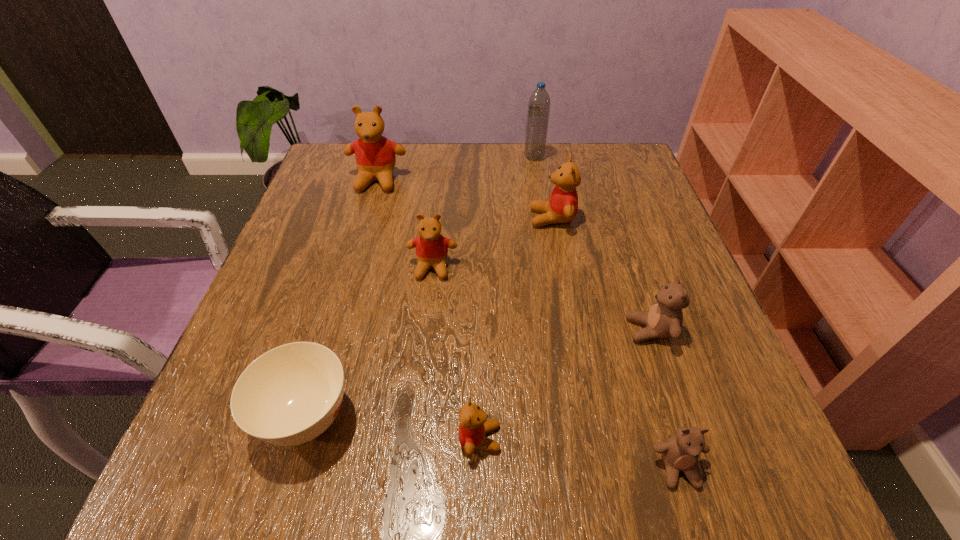
This screenshot has width=960, height=540. I want to click on vacant space at the near right corner of the desktop, so click(666, 469).

The height and width of the screenshot is (540, 960). I want to click on blank region between the farthest object and the smallest red teddy bear, so click(x=507, y=298).

This screenshot has height=540, width=960. In order to click on free spot between the third tallest object and the blue water bottle in this screenshot , I will do `click(543, 187)`.

The width and height of the screenshot is (960, 540). Find the location of `free space between the sugar bowl and the third teddy bear from right to left`. free space between the sugar bowl and the third teddy bear from right to left is located at coordinates (429, 318).

This screenshot has width=960, height=540. What are the coordinates of `free spot between the second farthest teddy bear and the nearest red teddy bear` in the screenshot? It's located at (516, 328).

Locate an element on the screen. This screenshot has width=960, height=540. unoccupied area between the bigger brown teddy bear and the third object from left to right is located at coordinates tap(541, 299).

Where is `empty space that is in between the fourth teddy bear from right to left and the sugar bowl`? empty space that is in between the fourth teddy bear from right to left and the sugar bowl is located at coordinates (394, 428).

Image resolution: width=960 pixels, height=540 pixels. In order to click on free point between the sugar bowl and the fourth farthest object in this screenshot , I will do 370,343.

Locate an element on the screen. The image size is (960, 540). vacant region between the fourth nearest object and the second red teddy bear from left to right is located at coordinates (541, 299).

Image resolution: width=960 pixels, height=540 pixels. Identify the location of unoccupied area between the blue water bottle and the smallest red teddy bear. (507, 298).